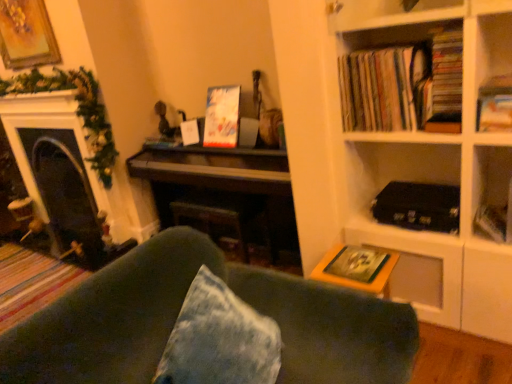
Question: Is hardcover book at upper right, arranged as the 2th book when viewed from the left, positioned before dark wood piano at center?

Choices:
 (A) no
 (B) yes

Answer: (B)

Question: From a real-world perspective, is hardcover book at upper right, arranged as the 2th book when viewed from the left, physically below dark wood piano at center?

Choices:
 (A) no
 (B) yes

Answer: (A)

Question: Is hardcover book at upper right, which appears as the first book when viewed from the right, surrounding dark wood piano at center?

Choices:
 (A) no
 (B) yes

Answer: (A)

Question: Does hardcover book at upper right, arranged as the 2th book when viewed from the left, have a greater height compared to dark wood piano at center?

Choices:
 (A) no
 (B) yes

Answer: (A)

Question: Is hardcover book at upper right, which appears as the first book when viewed from the right, completely or partially outside of dark wood piano at center?

Choices:
 (A) yes
 (B) no

Answer: (A)

Question: Is hardcover book at upper right, arranged as the 2th book when viewed from the left, at the right side of dark wood piano at center?

Choices:
 (A) yes
 (B) no

Answer: (A)

Question: Is gold-framed painting at upper left directly adjacent to green fabric couch at lower center?

Choices:
 (A) no
 (B) yes

Answer: (A)

Question: Is gold-framed painting at upper left outside green fabric couch at lower center?

Choices:
 (A) no
 (B) yes

Answer: (B)

Question: Does gold-framed painting at upper left have a larger size compared to green fabric couch at lower center?

Choices:
 (A) no
 (B) yes

Answer: (A)

Question: From a real-world perspective, does gold-framed painting at upper left sit lower than green fabric couch at lower center?

Choices:
 (A) yes
 (B) no

Answer: (B)

Question: Is gold-framed painting at upper left wider than green fabric couch at lower center?

Choices:
 (A) no
 (B) yes

Answer: (A)

Question: From a real-world perspective, is gold-framed painting at upper left over green fabric couch at lower center?

Choices:
 (A) no
 (B) yes

Answer: (B)

Question: From a real-world perspective, is matte black fireplace at left below matte cardboard books at upper right, which appears as the 1th book when viewed from the left?

Choices:
 (A) yes
 (B) no

Answer: (A)